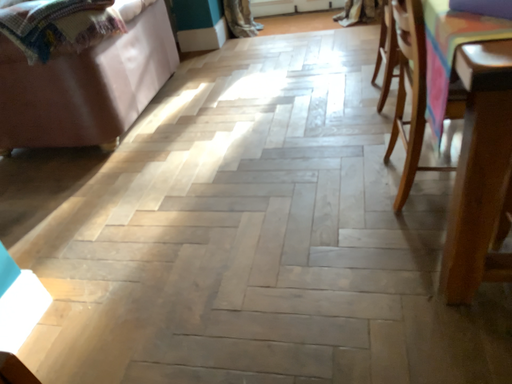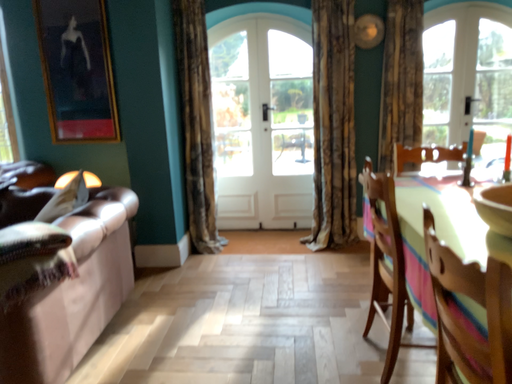
Question: Which way did the camera rotate in the video?

Choices:
 (A) rotated upward
 (B) rotated downward

Answer: (A)